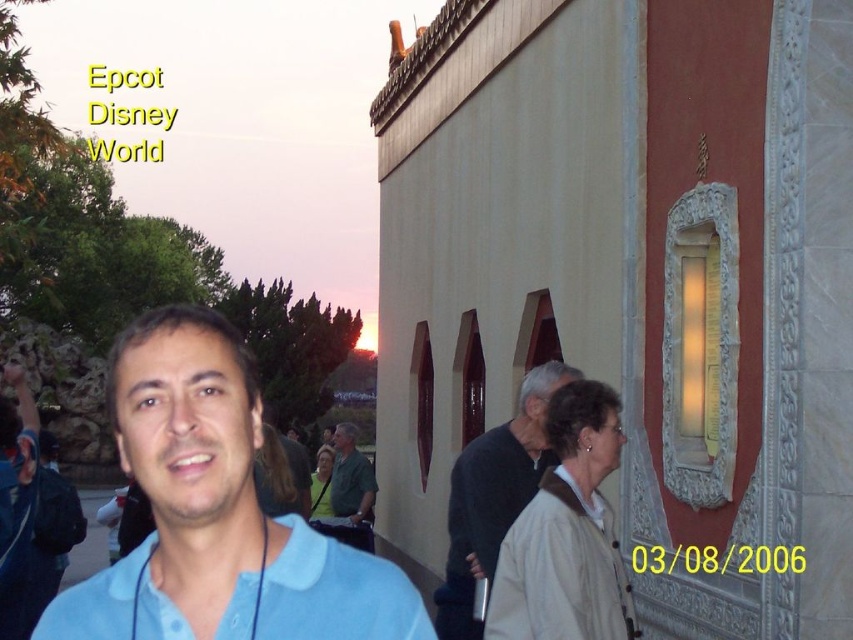
Question: Which point appears closest to the camera in this image?

Choices:
 (A) (428, 634)
 (B) (225, 460)

Answer: (A)

Question: Can you confirm if light blue cotton polo shirt at center is wider than green fabric shirt at center?

Choices:
 (A) no
 (B) yes

Answer: (B)

Question: Can you confirm if dark gray sweater at center is thinner than green fabric shirt at center?

Choices:
 (A) no
 (B) yes

Answer: (A)

Question: Which object is closer to the camera taking this photo?

Choices:
 (A) beige cotton polo shirt at center
 (B) dark gray sweater at center
 (C) green fabric shirt at center

Answer: (A)

Question: Does light blue cotton shirt at center appear on the left side of green fabric shirt at center?

Choices:
 (A) yes
 (B) no

Answer: (B)

Question: Estimate the real-world distances between objects in this image. Which object is closer to the beige cotton polo shirt at center?

Choices:
 (A) dark gray sweater at center
 (B) light blue cotton shirt at center
 (C) light blue cotton polo shirt at center

Answer: (A)